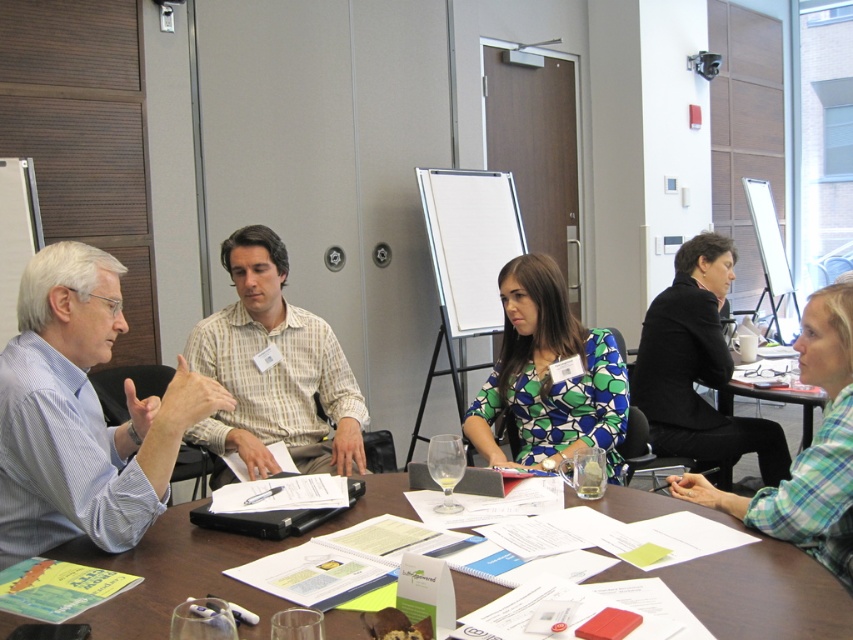
You are a participant in the meeting and need to refer to the white paper at center. Which direction should you look to find it relative to the green plaid shirt at lower right?

The white paper at center is in front of the green plaid shirt at lower right, so you should look forward towards the table to find it.